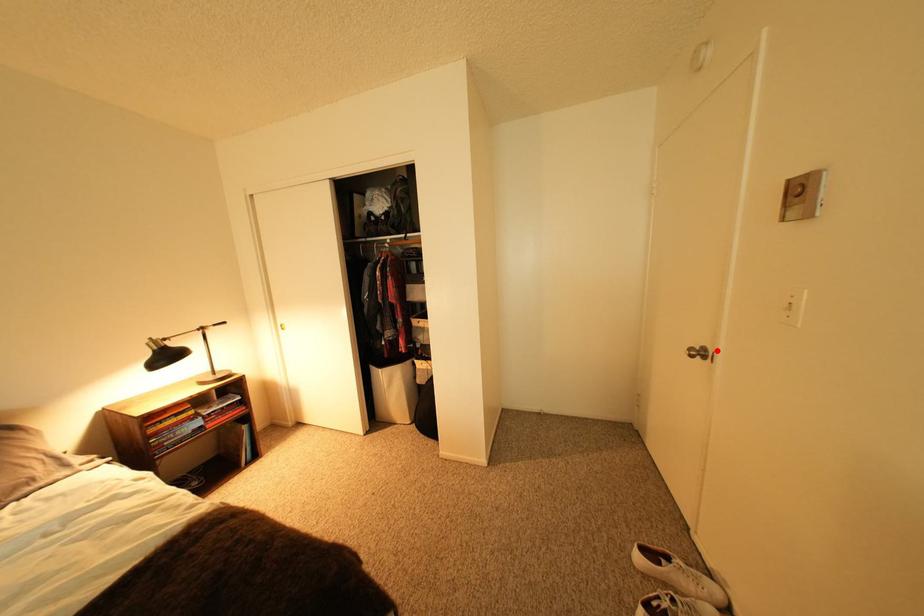
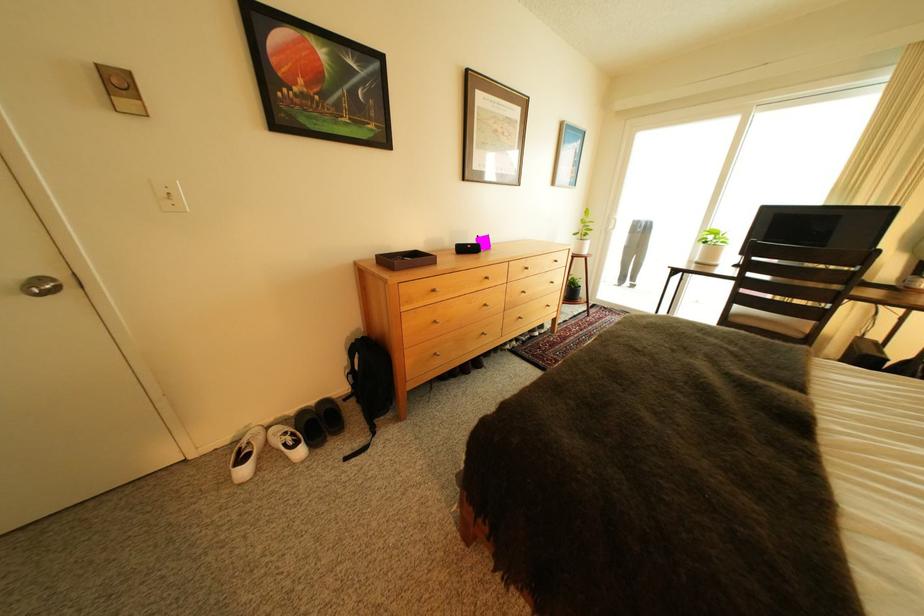
The point at the highlighted location is marked in the first image. Where is the corresponding point in the second image?

(55, 281)